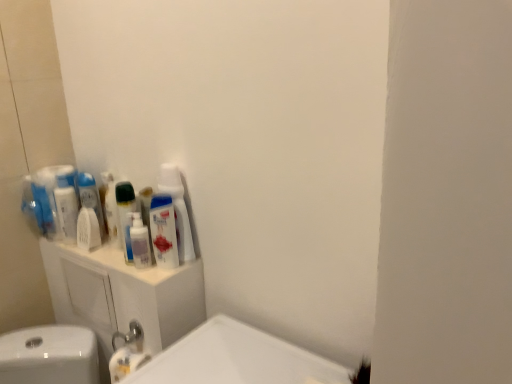
I want to click on free area in between translucent plastic mouthwash at center, the second mouthwash positioned from the right, and white matte mouthwash at left, placed as the 3th mouthwash when sorted from right to left, so click(x=111, y=256).